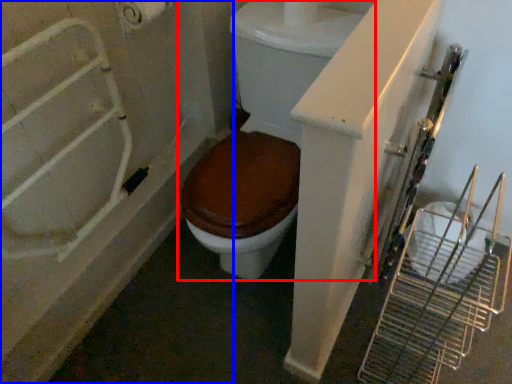
Question: Among these objects, which one is nearest to the camera, toilet (highlighted by a red box) or bath (highlighted by a blue box)?

Choices:
 (A) toilet
 (B) bath

Answer: (A)